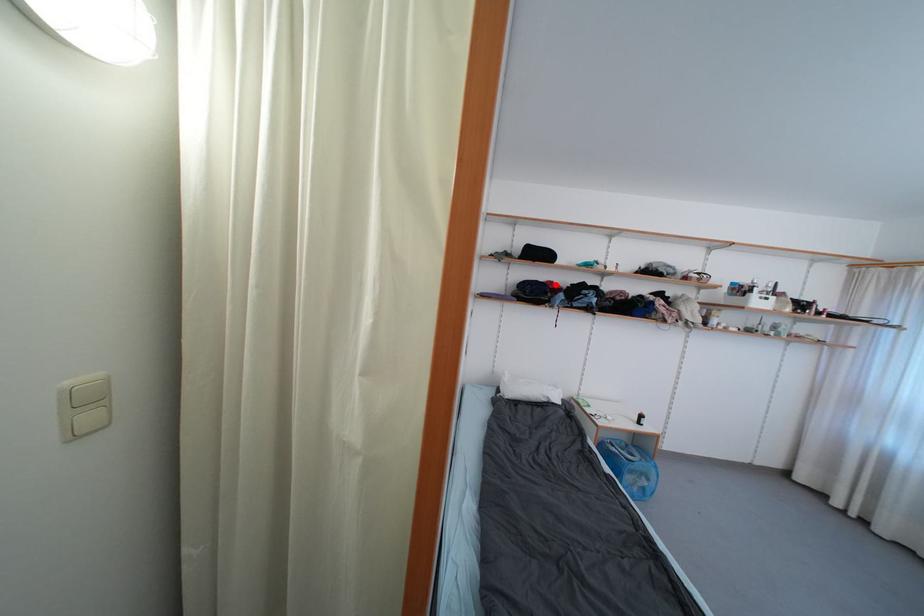
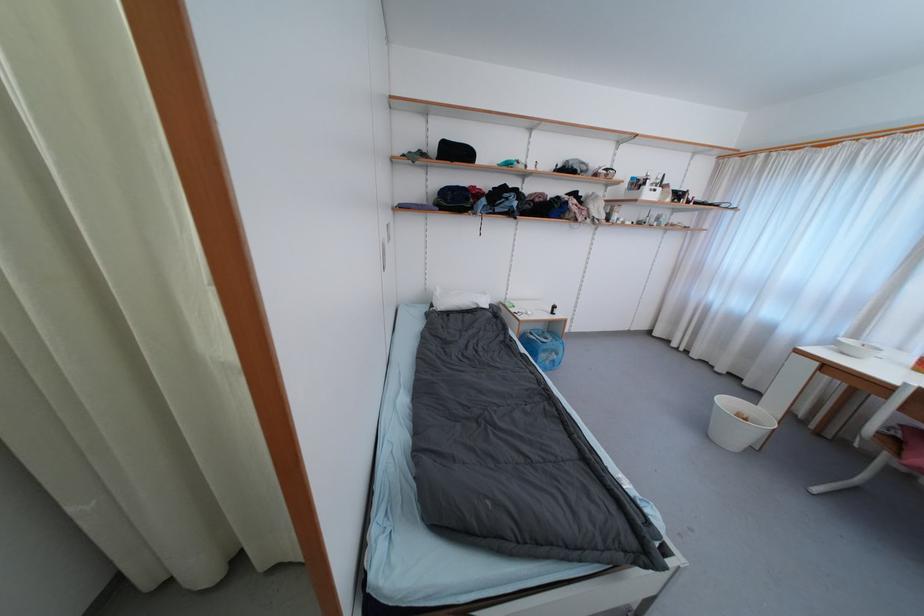
The point at the highlighted location is marked in the first image. Where is the corresponding point in the second image?

(478, 190)